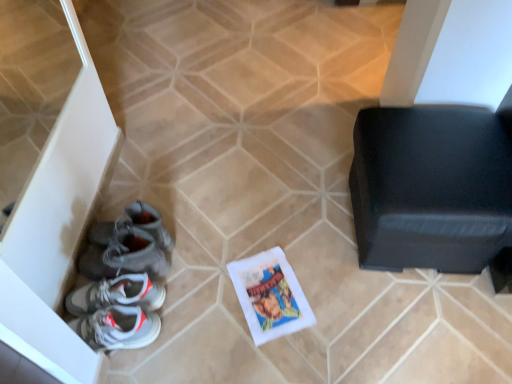
Question: Is gray suede sneakers at lower left at the back of white paper comic book at center?

Choices:
 (A) yes
 (B) no

Answer: (B)

Question: Does white paper comic book at center have a larger size compared to gray suede sneakers at lower left?

Choices:
 (A) no
 (B) yes

Answer: (A)

Question: From the image's perspective, does white paper comic book at center appear lower than gray suede sneakers at lower left?

Choices:
 (A) no
 (B) yes

Answer: (B)

Question: Can you confirm if white paper comic book at center is thinner than gray suede sneakers at lower left?

Choices:
 (A) yes
 (B) no

Answer: (A)

Question: Considering the relative sizes of white paper comic book at center and gray suede sneakers at lower left in the image provided, is white paper comic book at center taller than gray suede sneakers at lower left?

Choices:
 (A) no
 (B) yes

Answer: (A)

Question: Does white paper comic book at center have a greater width compared to gray suede sneakers at lower left?

Choices:
 (A) no
 (B) yes

Answer: (A)

Question: Is black leather ottoman at right turned away from gray suede sneakers at lower left?

Choices:
 (A) yes
 (B) no

Answer: (B)

Question: From the image's perspective, is black leather ottoman at right on top of gray suede sneakers at lower left?

Choices:
 (A) no
 (B) yes

Answer: (B)

Question: Does black leather ottoman at right have a greater width compared to gray suede sneakers at lower left?

Choices:
 (A) yes
 (B) no

Answer: (A)

Question: Is the position of black leather ottoman at right more distant than that of gray suede sneakers at lower left?

Choices:
 (A) yes
 (B) no

Answer: (B)

Question: From the image's perspective, is black leather ottoman at right under gray suede sneakers at lower left?

Choices:
 (A) yes
 (B) no

Answer: (B)

Question: Could gray suede sneakers at lower left be considered to be inside black leather ottoman at right?

Choices:
 (A) yes
 (B) no

Answer: (B)

Question: Is white paper comic book at center far from black leather ottoman at right?

Choices:
 (A) no
 (B) yes

Answer: (A)